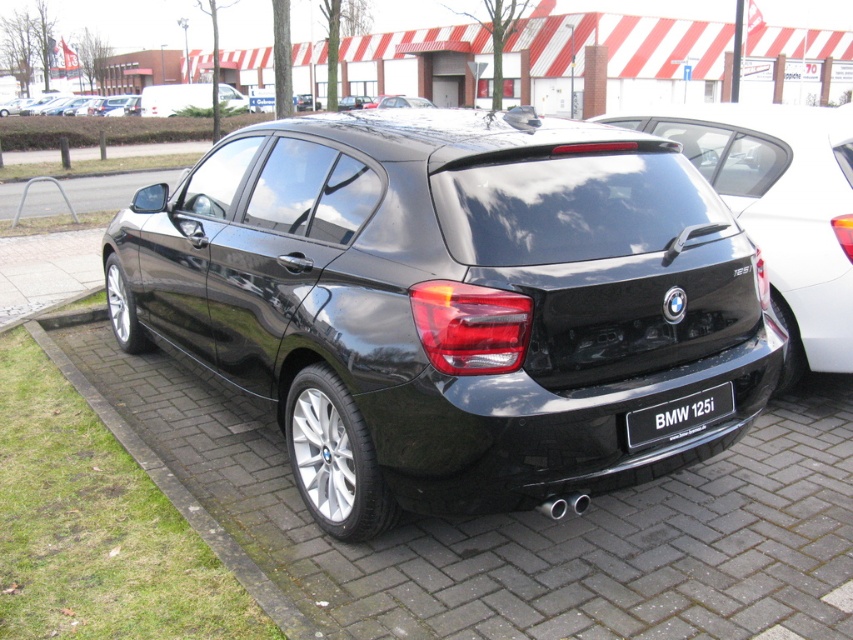
Between point (508, 273) and point (787, 301), which one is positioned behind?

The point (787, 301) is more distant.

Who is more forward, [618,458] or [824,138]?

Point [618,458]

Which is behind, point (344, 472) or point (799, 321)?

Point (799, 321)

The width and height of the screenshot is (853, 640). I want to click on glossy black car at center, so click(450, 304).

Between black glossy hatchback at center and black plastic license plate at center, which one appears on the right side from the viewer's perspective?

black glossy hatchback at center is more to the right.

Which is behind, point (733, 122) or point (647, 413)?

The point (733, 122) is more distant.

At what (x,y) coordinates should I click in order to perform the action: click on black glossy hatchback at center. Please return your answer as a coordinate pair (x, y). The width and height of the screenshot is (853, 640). Looking at the image, I should click on click(x=781, y=209).

Is black concrete curb at lower left in front of metallic silver minivan at upper left?

Yes, it is.

Who is more forward, (245, 560) or (225, 106)?

Point (245, 560)

I want to click on black concrete curb at lower left, so click(x=170, y=480).